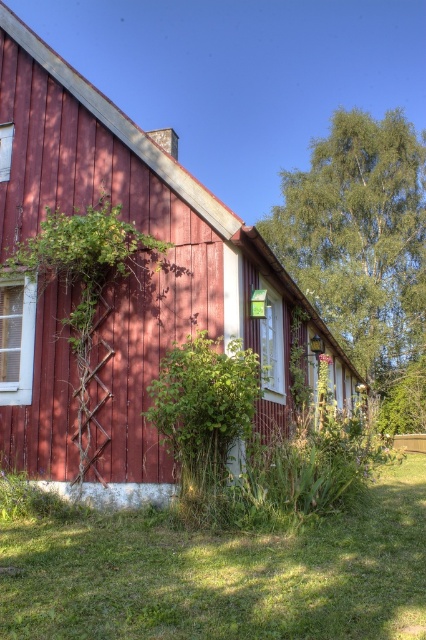
You are standing in front of the rustic red wooden building and want to place a small garden ornament. The ornament requires a spot with at least 0.5 meters of space in all directions. Is the green leafy bush at lower center a suitable location?

The green leafy bush at lower center is located at point (204, 404), so the ornament can be placed there as long as there is enough space around it. However, the exact distance from other objects isn

You are standing in front of the rustic red wooden building and want to take a photo that includes both the wooden hut at center and the green leafy tree at upper right. Which object will appear larger in the photo?

The wooden hut at center will appear larger in the photo because it is closer to the viewer than the green leafy tree at upper right.